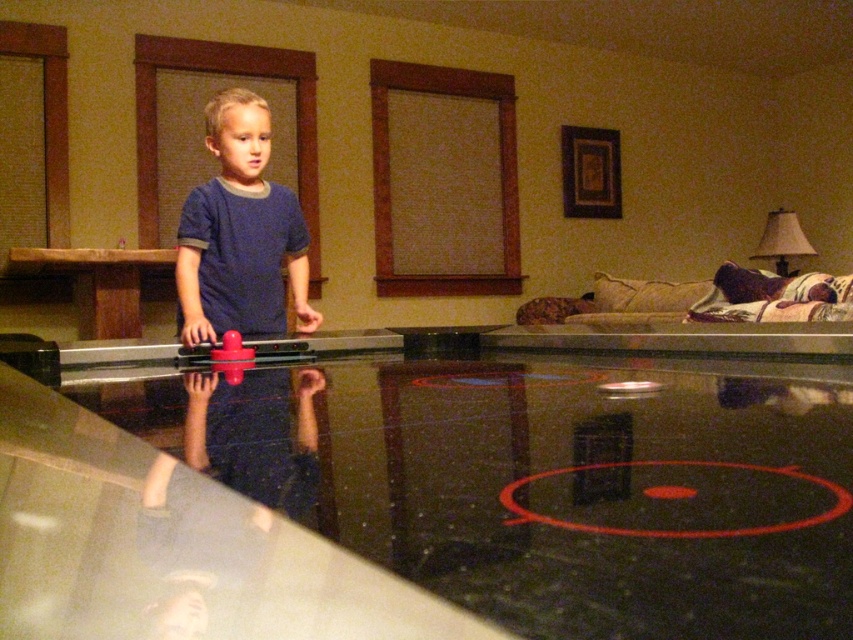
What do you see at coordinates (424, 502) in the screenshot?
I see `transparent glass table at center` at bounding box center [424, 502].

Is point (579, 497) in front of point (209, 106)?

Yes, point (579, 497) is in front of point (209, 106).

The image size is (853, 640). Identify the location of transparent glass table at center. (424, 502).

Does blue matte shirt at center have a larger size compared to rubberized plastic toy at center?

Correct, blue matte shirt at center is larger in size than rubberized plastic toy at center.

Who is more distant from viewer, (x=315, y=312) or (x=234, y=333)?

Point (x=315, y=312)

This screenshot has width=853, height=640. What do you see at coordinates (241, 234) in the screenshot?
I see `blue matte shirt at center` at bounding box center [241, 234].

The width and height of the screenshot is (853, 640). In order to click on blue matte shirt at center in this screenshot , I will do `click(241, 234)`.

Is transparent glass table at center positioned in front of rubberized plastic toy at center?

Yes, transparent glass table at center is in front of rubberized plastic toy at center.

Which is above, transparent glass table at center or rubberized plastic toy at center?

Positioned higher is rubberized plastic toy at center.

Is point (809, 424) positioned after point (224, 336)?

That is False.

At what (x,y) coordinates should I click in order to perform the action: click on transparent glass table at center. Please return your answer as a coordinate pair (x, y). Image resolution: width=853 pixels, height=640 pixels. Looking at the image, I should click on (424, 502).